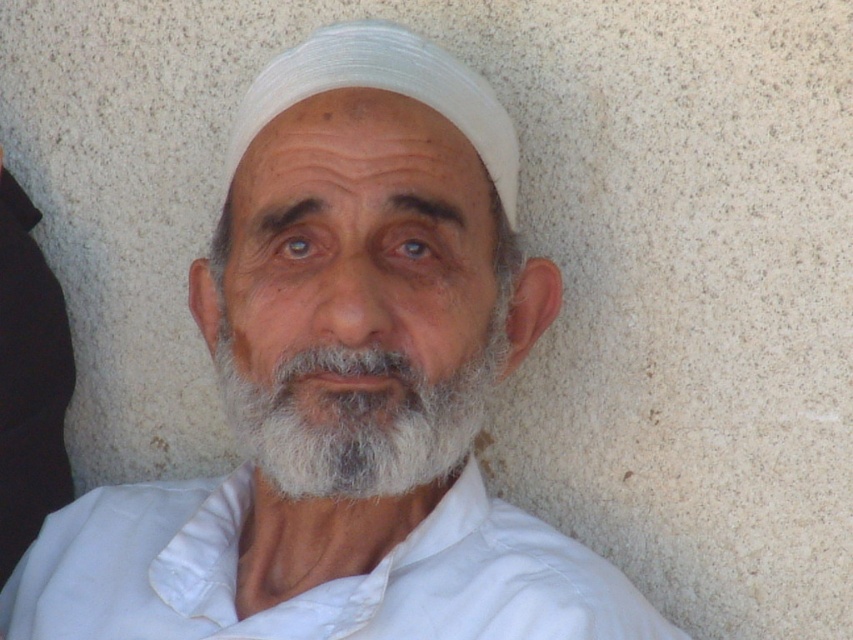
Question: Can you confirm if white matte headscarf at center is thinner than white fabric headscarf at center?

Choices:
 (A) no
 (B) yes

Answer: (A)

Question: Which of these objects is positioned closest to the white matte headscarf at center?

Choices:
 (A) white cotton shirt at center
 (B) white soft beard at center
 (C) black fabric at left

Answer: (B)

Question: Can you confirm if white soft beard at center is smaller than black fabric at left?

Choices:
 (A) yes
 (B) no

Answer: (B)

Question: Which point is closer to the camera?

Choices:
 (A) black fabric at left
 (B) white matte headscarf at center
 (C) white cotton shirt at center
 (D) white fabric headscarf at center

Answer: (B)

Question: Is white matte headscarf at center to the right of white cotton shirt at center from the viewer's perspective?

Choices:
 (A) yes
 (B) no

Answer: (A)

Question: Which of the following is the closest to the observer?

Choices:
 (A) white soft beard at center
 (B) white cotton shirt at center
 (C) white fabric headscarf at center

Answer: (A)